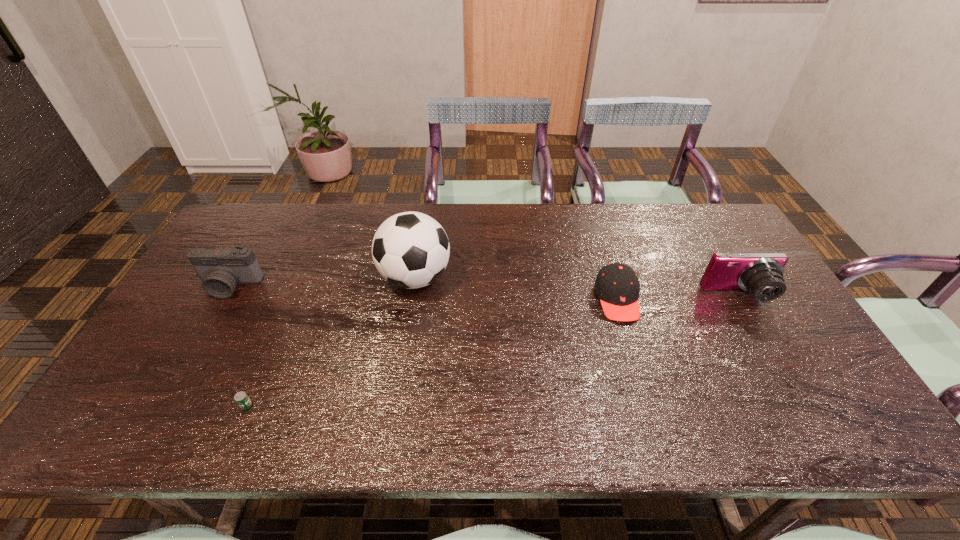
The height and width of the screenshot is (540, 960). I want to click on empty space that is in between the leftmost object and the second object from left to right, so click(238, 346).

Locate an element on the screen. empty space that is in between the third object from left to right and the right camera is located at coordinates (577, 287).

Find the location of `free space that is in between the rightmost object and the fourth tallest object`. free space that is in between the rightmost object and the fourth tallest object is located at coordinates (678, 298).

Image resolution: width=960 pixels, height=540 pixels. In order to click on unoccupied position between the leftmost object and the shortest object in this screenshot , I will do pos(238,346).

At what (x,y) coordinates should I click in order to perform the action: click on vacant space that is in between the third object from right to left and the rightmost object. Please return your answer as a coordinate pair (x, y). Looking at the image, I should click on (577, 287).

Where is `empty space between the shortest object and the left camera`? empty space between the shortest object and the left camera is located at coordinates (238, 346).

Locate an element on the screen. free space between the fourth tallest object and the second object from left to right is located at coordinates (432, 352).

The image size is (960, 540). I want to click on unoccupied area between the second object from left to right and the right camera, so click(492, 351).

Image resolution: width=960 pixels, height=540 pixels. Identify the location of free space between the shortest object and the tallest object. (330, 342).

Find the location of a particular element. free space between the beer can and the tallest object is located at coordinates (330, 342).